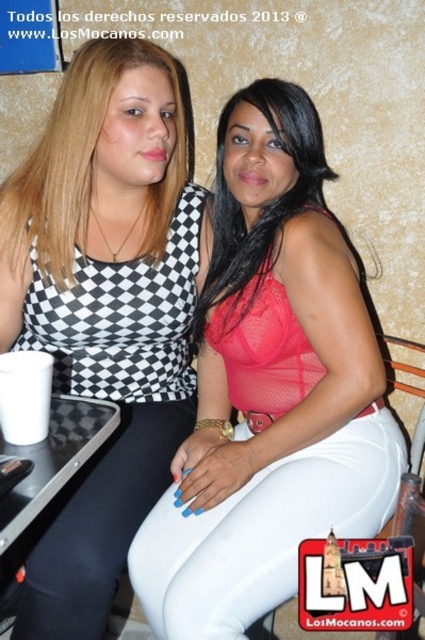
What do you see at coordinates (90, 160) in the screenshot? I see `matte red dress at center` at bounding box center [90, 160].

Who is higher up, matte red dress at center or matte red blouse at center?

matte red dress at center is higher up.

Is point (23, 230) more distant than point (224, 124)?

Yes, it is.

Find the location of a particular element. matte red dress at center is located at coordinates (90, 160).

Is point (295, 564) in front of point (62, 176)?

Yes, it is.

Who is more forward, (x=249, y=486) or (x=88, y=108)?

Point (x=88, y=108) is more forward.

Image resolution: width=425 pixels, height=640 pixels. Find the location of `pink mesh top at center`. pink mesh top at center is located at coordinates (269, 388).

Who is taller, pink mesh top at center or matte red blouse at center?

pink mesh top at center

Is point (147, 620) farther from camera compared to point (299, 208)?

No, (147, 620) is in front of (299, 208).

What are the coordinates of `pink mesh top at center` in the screenshot? It's located at (269, 388).

Identify the location of pink mesh top at center. (269, 388).